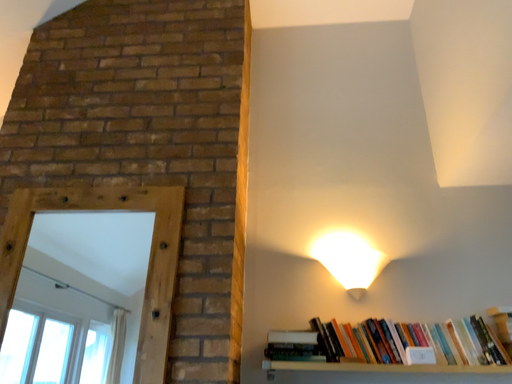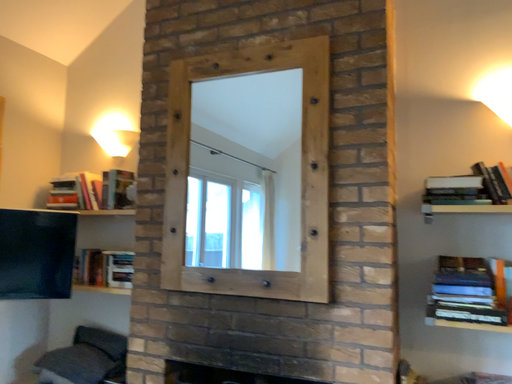
Question: How did the camera likely rotate when shooting the video?

Choices:
 (A) rotated downward
 (B) rotated upward

Answer: (A)